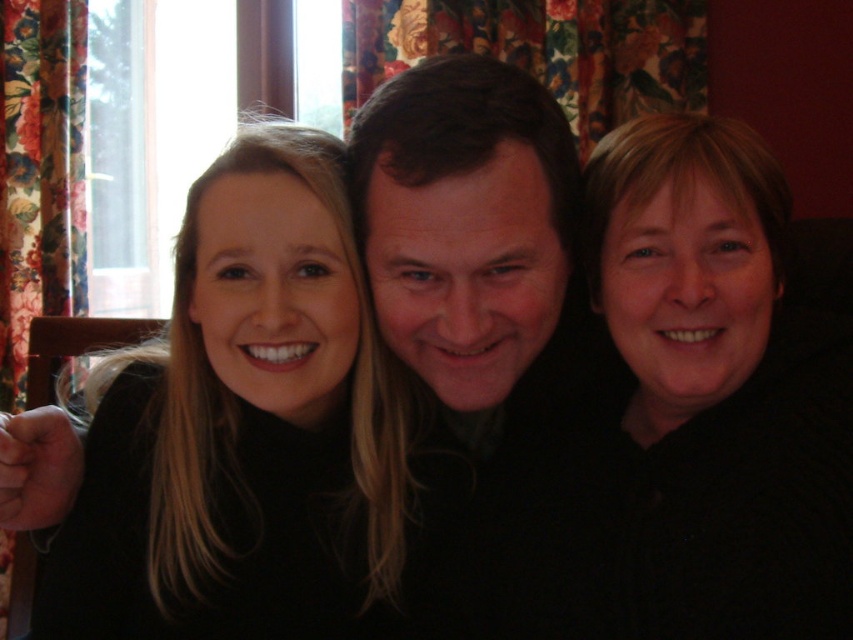
Question: Considering the relative positions of black matte hair at upper right and floral fabric curtain at left in the image provided, where is black matte hair at upper right located with respect to floral fabric curtain at left?

Choices:
 (A) right
 (B) left

Answer: (A)

Question: Among these points, which one is farthest from the camera?

Choices:
 (A) (125, 548)
 (B) (639, 244)
 (C) (366, 218)
 (D) (86, 225)

Answer: (D)

Question: Does smooth black hair at center have a greater width compared to black matte hair at upper right?

Choices:
 (A) no
 (B) yes

Answer: (B)

Question: Which point is farther from the camera taking this photo?

Choices:
 (A) (22, 369)
 (B) (461, 136)
 (C) (715, 225)
 (D) (396, 490)

Answer: (A)

Question: Does smooth black hair at center have a lesser width compared to smooth skin face at center?

Choices:
 (A) yes
 (B) no

Answer: (B)

Question: Which point is closer to the camera?

Choices:
 (A) (408, 355)
 (B) (730, 138)

Answer: (B)